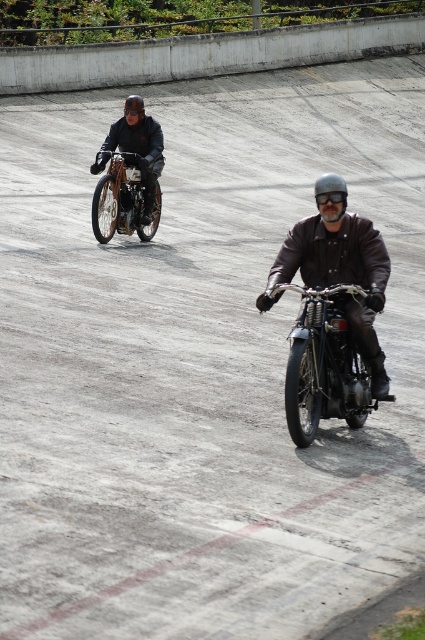
Measure the distance between leather jacket at center and camera.

26.74 feet

In the scene shown: Does leather jacket at center appear on the left side of brushed metal helmet at upper center?

No, leather jacket at center is not to the left of brushed metal helmet at upper center.

Who is more distant from viewer, [300,224] or [138,109]?

The point [138,109] is more distant.

Locate an element on the screen. This screenshot has height=640, width=425. leather jacket at center is located at coordinates (339, 268).

Is leather jacket at center wider than shiny chrome motorcycle at center?

Yes.

This screenshot has width=425, height=640. I want to click on leather jacket at center, so click(339, 268).

Is point (371, 246) positioned after point (303, 422)?

Yes, it is behind point (303, 422).

This screenshot has width=425, height=640. I want to click on leather jacket at center, so click(x=339, y=268).

Does point (119, 188) lie behind point (129, 104)?

Yes, point (119, 188) is farther from viewer.

Can you confirm if shiny chrome motorcycle at upper left is wider than brushed metal helmet at upper center?

Yes, shiny chrome motorcycle at upper left is wider than brushed metal helmet at upper center.

Identify the location of shiny chrome motorcycle at upper left. coord(122,198).

Image resolution: width=425 pixels, height=640 pixels. Identify the location of shiny chrome motorcycle at upper left. (122, 198).